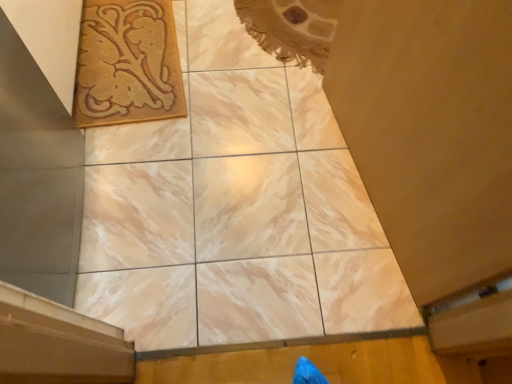
You are a GUI agent. You are given a task and a screenshot of the screen. Output one action in this format:
    pyautogui.click(x=<x>, y=<y>)
    Task: Click on the empty space that is ontop of marble tile at center (from a real-world perspective)
    
    Given the screenshot: What is the action you would take?
    [x=221, y=206]